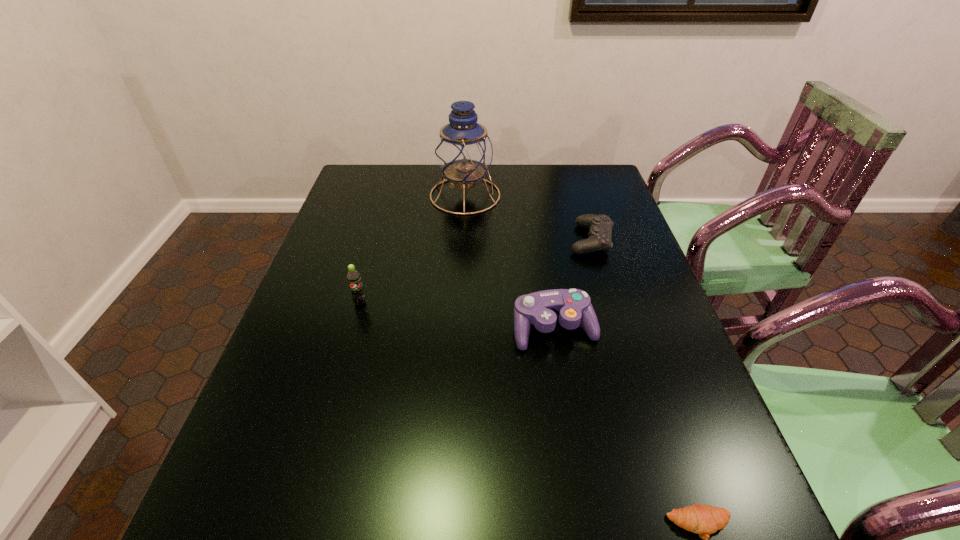
At what (x,y) coordinates should I click in order to perform the action: click on lantern. Please return your answer as a coordinate pair (x, y). Image resolution: width=960 pixels, height=540 pixels. Looking at the image, I should click on (x=464, y=152).

Where is `the tallest object`? Image resolution: width=960 pixels, height=540 pixels. the tallest object is located at coordinates (464, 152).

The width and height of the screenshot is (960, 540). In order to click on the fourth shortest object in this screenshot , I will do `click(353, 277)`.

Locate an element on the screen. The image size is (960, 540). the leftmost object is located at coordinates (353, 277).

You are a GUI agent. You are given a task and a screenshot of the screen. Output one action in this format:
    pyautogui.click(x=<x>, y=<y>)
    Task: Click on the nearer control
    The image size is (960, 540).
    Given the screenshot: What is the action you would take?
    pyautogui.click(x=572, y=306)

At what (x,y) coordinates should I click in order to perform the action: click on the third shortest object. Please return your answer as a coordinate pair (x, y). This screenshot has height=540, width=960. Looking at the image, I should click on (572, 306).

Locate an element on the screen. the second shortest object is located at coordinates (600, 234).

Locate an element on the screen. the shorter control is located at coordinates (600, 234).

Identify the location of free space located 0.380m on the front-facing side of the second object from left to right. Image resolution: width=960 pixels, height=540 pixels. (612, 195).

This screenshot has width=960, height=540. Identify the location of free point located 0.320m on the front label of the soda. (325, 425).